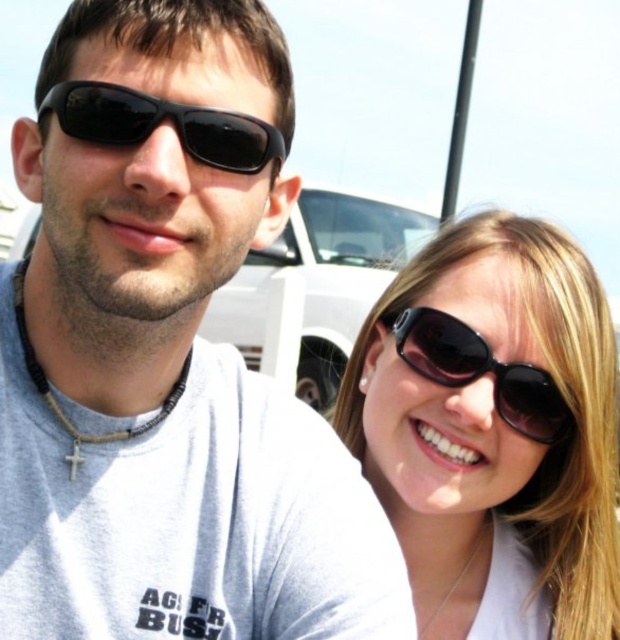
Who is positioned more to the right, matte black sunglasses at right or black matte sunglasses at upper center?

matte black sunglasses at right is more to the right.

From the picture: Can you confirm if matte black sunglasses at right is positioned below black matte sunglasses at upper center?

Correct, matte black sunglasses at right is located below black matte sunglasses at upper center.

You are a GUI agent. You are given a task and a screenshot of the screen. Output one action in this format:
    pyautogui.click(x=<x>, y=<y>)
    Task: Click on the matte black sunglasses at right
    The height and width of the screenshot is (640, 620).
    Given the screenshot: What is the action you would take?
    pyautogui.click(x=494, y=432)

Locate an element on the screen. matte black sunglasses at right is located at coordinates (494, 432).

Who is lower down, matte black sunglasses at upper left or matte black sunglasses at right?

matte black sunglasses at right is below.

Who is more distant from viewer, (153, 140) or (485, 333)?

Point (485, 333)

Image resolution: width=620 pixels, height=640 pixels. Find the location of `matte black sunglasses at upper left`. matte black sunglasses at upper left is located at coordinates (x=166, y=355).

Which is behind, point (138, 120) or point (528, 417)?

Positioned behind is point (528, 417).

In the scene shown: Can you confirm if matte black sunglasses at upper left is thinner than black matte sunglasses at upper right?

Incorrect, matte black sunglasses at upper left's width is not less than black matte sunglasses at upper right's.

I want to click on matte black sunglasses at upper left, so click(166, 355).

Locate an element on the screen. matte black sunglasses at upper left is located at coordinates (166, 355).